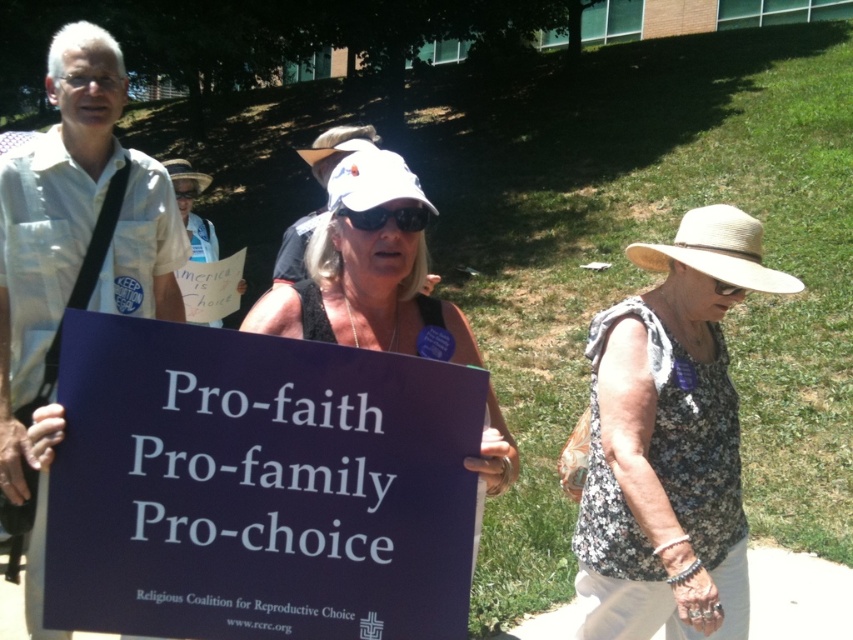
Does dark blue paper sign at center lie behind floral fabric dress at right?

That is False.

Which is in front, point (392, 550) or point (671, 499)?

Point (392, 550)

Is point (387, 413) positioned in front of point (592, 369)?

Yes, point (387, 413) is closer to viewer.

Identify the location of dark blue paper sign at center. (258, 486).

Is floral fabric dress at right bigger than white fabric hat at center?

Incorrect, floral fabric dress at right is not larger than white fabric hat at center.

What do you see at coordinates (669, 442) in the screenshot? I see `floral fabric dress at right` at bounding box center [669, 442].

Does point (682, 365) come behind point (361, 154)?

Yes, it is.

Identify the location of floral fabric dress at right. This screenshot has height=640, width=853. coord(669,442).

Is dark blue paper sign at center above white fabric hat at center?

No, dark blue paper sign at center is not above white fabric hat at center.

Between dark blue paper sign at center and white fabric hat at center, which one has less height?

Standing shorter between the two is dark blue paper sign at center.

Is point (172, 627) positioned behind point (393, 237)?

That is False.

At what (x,y) coordinates should I click in order to perform the action: click on dark blue paper sign at center. Please return your answer as a coordinate pair (x, y). Looking at the image, I should click on (258, 486).